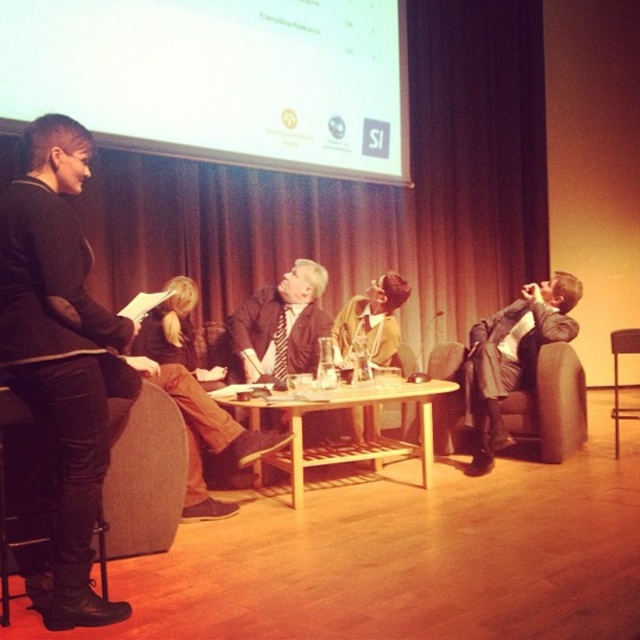
You are organizing a small event and need to seat a guest wearing the matte black suit at center. The guest requires a chair that is larger than their outfit. Can the metallic silver chair at right accommodate them?

The matte black suit at center has a smaller size compared to the metallic silver chair at right, so yes, the metallic silver chair at right can accommodate the guest since it is larger than the matte black suit at center.

You are standing in the conference room and see the point marked at coordinates (193, 397). Based on the scene description, where is this point located?

The point at coordinates (193, 397) is located on the brown leather jacket at center.